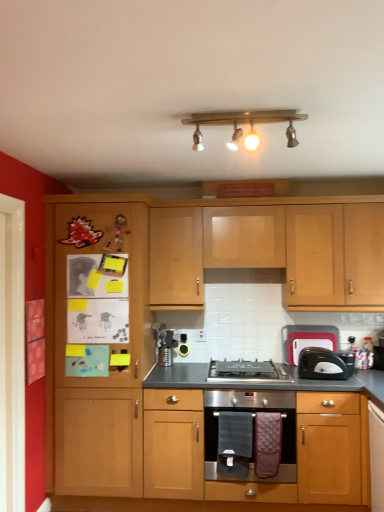
Find the location of a particular element. This screenshot has width=384, height=512. blank space situated above wooden light fixture at upper center (from a real-world perspective) is located at coordinates (262, 110).